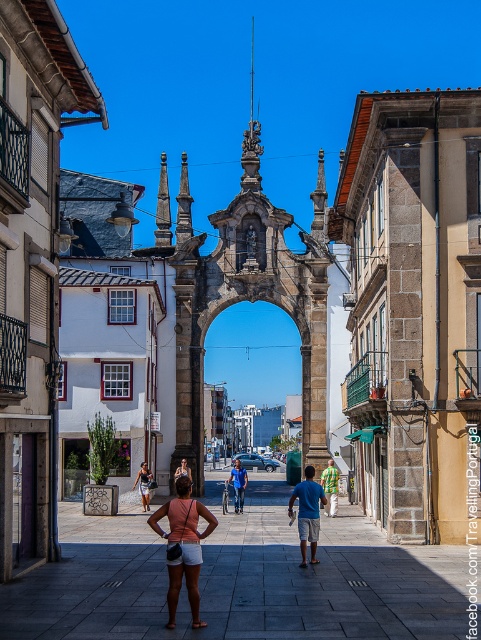
Can you confirm if smooth stone alley at center is smaller than blue denim jeans at center?

Incorrect, smooth stone alley at center is not smaller in size than blue denim jeans at center.

Does smooth stone alley at center have a greater height compared to blue denim jeans at center?

In fact, smooth stone alley at center may be shorter than blue denim jeans at center.

This screenshot has height=640, width=481. In order to click on smooth stone alley at center in this screenshot , I will do `click(240, 579)`.

Which is behind, point (315, 556) or point (238, 464)?

Positioned behind is point (238, 464).

Can you confirm if blue cotton shirt at center is bigger than blue denim jeans at center?

Yes, blue cotton shirt at center is bigger than blue denim jeans at center.

Where is `blue cotton shirt at center`? This screenshot has width=481, height=640. blue cotton shirt at center is located at coordinates (307, 513).

This screenshot has height=640, width=481. Identify the location of blue cotton shirt at center. (307, 513).

Is point (333, 481) positioned after point (147, 484)?

No.

Which of these two, green plaid shirt at center or matte black shorts at center, stands shorter?

green plaid shirt at center

Locate an element on the screen. green plaid shirt at center is located at coordinates (329, 486).